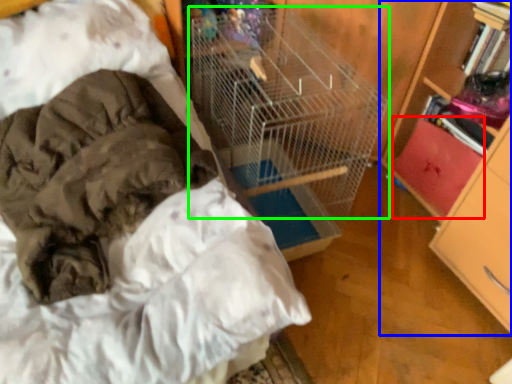
Question: Estimate the real-world distances between objects in this image. Which object is closer to drawer (highlighted by a red box), bookcase (highlighted by a blue box) or bird cage (highlighted by a green box)?

Choices:
 (A) bookcase
 (B) bird cage

Answer: (A)